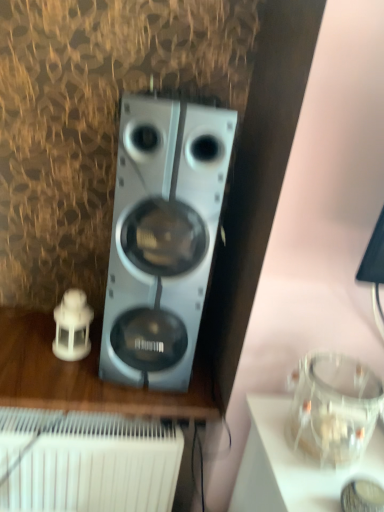
Question: From a real-world perspective, is white plastic speaker at left below white plastic radiator at lower left?

Choices:
 (A) no
 (B) yes

Answer: (A)

Question: Does white plastic speaker at left contain white plastic radiator at lower left?

Choices:
 (A) yes
 (B) no

Answer: (B)

Question: Considering the relative sizes of white plastic speaker at left and white plastic radiator at lower left in the image provided, is white plastic speaker at left wider than white plastic radiator at lower left?

Choices:
 (A) yes
 (B) no

Answer: (B)

Question: Considering the relative positions of white plastic speaker at left and white plastic radiator at lower left in the image provided, is white plastic speaker at left behind white plastic radiator at lower left?

Choices:
 (A) yes
 (B) no

Answer: (A)

Question: Can you confirm if white plastic speaker at left is taller than white plastic radiator at lower left?

Choices:
 (A) no
 (B) yes

Answer: (A)

Question: Considering the relative positions of white plastic radiator at lower left and satin silver speaker at center in the image provided, is white plastic radiator at lower left to the left or to the right of satin silver speaker at center?

Choices:
 (A) left
 (B) right

Answer: (A)

Question: From a real-world perspective, is white plastic radiator at lower left positioned above or below satin silver speaker at center?

Choices:
 (A) below
 (B) above

Answer: (A)

Question: In terms of width, does white plastic radiator at lower left look wider or thinner when compared to satin silver speaker at center?

Choices:
 (A) thin
 (B) wide

Answer: (B)

Question: From their relative heights in the image, would you say white plastic radiator at lower left is taller or shorter than satin silver speaker at center?

Choices:
 (A) short
 (B) tall

Answer: (A)

Question: Is white plastic speaker at left spatially inside white plastic radiator at lower left, or outside of it?

Choices:
 (A) outside
 (B) inside

Answer: (A)

Question: Looking at the image, does white plastic speaker at left seem bigger or smaller compared to white plastic radiator at lower left?

Choices:
 (A) big
 (B) small

Answer: (B)

Question: Considering the positions of white plastic speaker at left and white plastic radiator at lower left in the image, is white plastic speaker at left taller or shorter than white plastic radiator at lower left?

Choices:
 (A) short
 (B) tall

Answer: (A)

Question: Is point (46, 330) closer or farther from the camera than point (41, 420)?

Choices:
 (A) closer
 (B) farther

Answer: (B)

Question: Looking at their shapes, would you say satin silver speaker at center is wider or thinner than white plastic speaker at left?

Choices:
 (A) thin
 (B) wide

Answer: (A)

Question: In terms of size, does satin silver speaker at center appear bigger or smaller than white plastic speaker at left?

Choices:
 (A) big
 (B) small

Answer: (A)